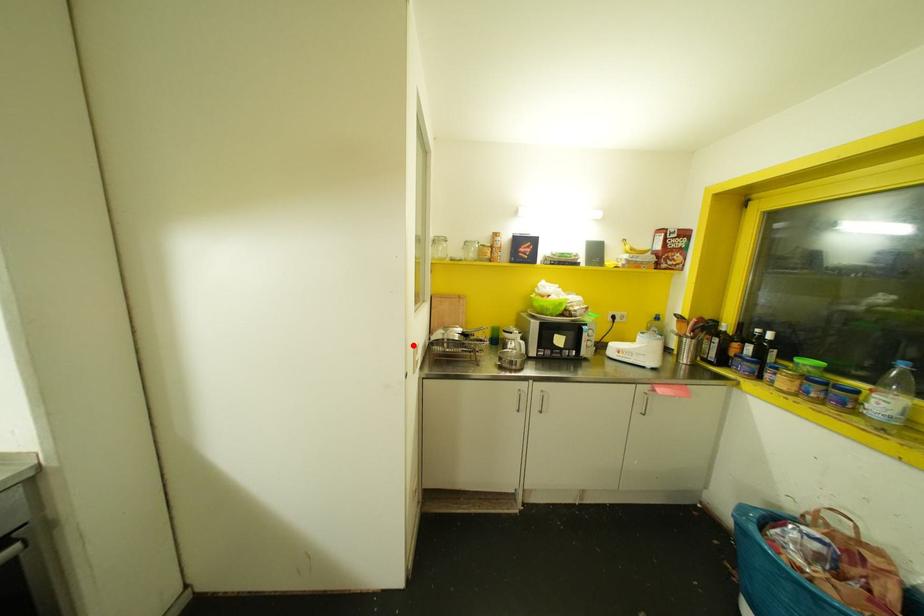
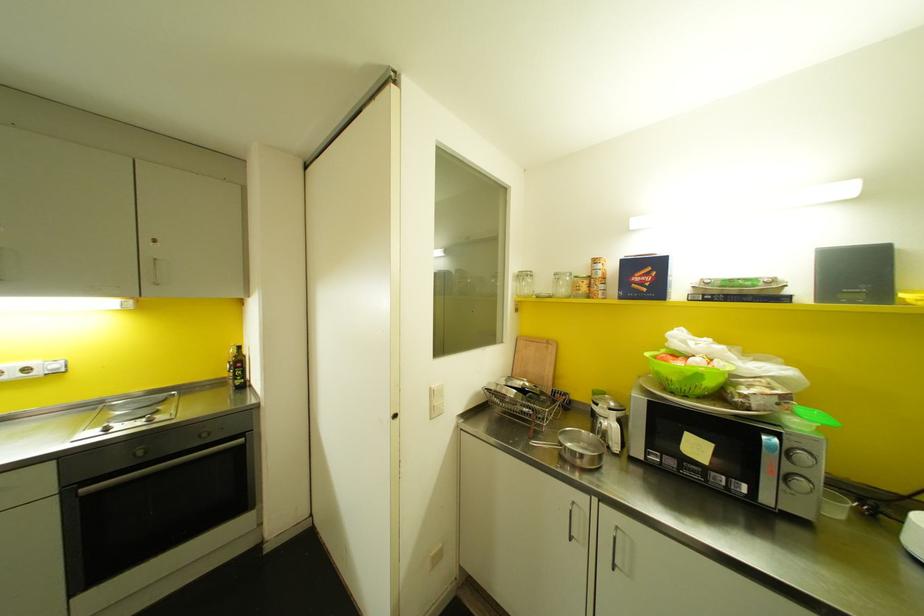
Question: I am providing you with two images of the same scene from different viewpoints. Given a red point in image1, look at the same physical point in image2. Is it:

Choices:
 (A) Closer to the viewpoint
 (B) Farther from the viewpoint

Answer: (B)